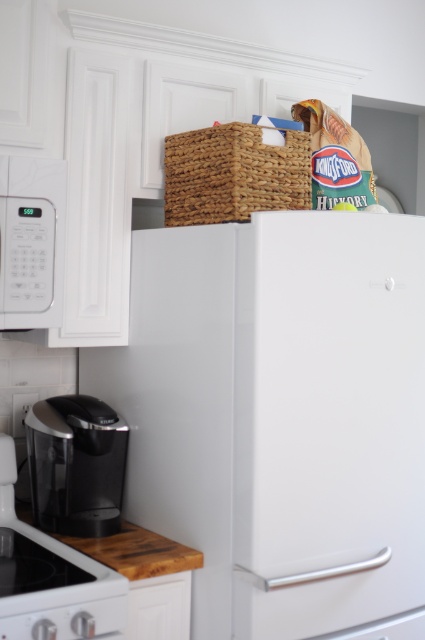
Question: Does white matte refrigerator at center lie in front of wooden cutting board at lower left?

Choices:
 (A) no
 (B) yes

Answer: (B)

Question: Does woven brown basket at upper center appear on the left side of sleek black coffee maker at lower left?

Choices:
 (A) yes
 (B) no

Answer: (B)

Question: Does woven brown basket at upper center have a smaller size compared to sleek black coffee maker at lower left?

Choices:
 (A) no
 (B) yes

Answer: (A)

Question: Which of the following is the farthest from the observer?

Choices:
 (A) (99, 461)
 (B) (150, 544)
 (C) (178, 308)

Answer: (A)

Question: Which of these objects is positioned closest to the woven brown basket at upper center?

Choices:
 (A) wooden cutting board at lower left
 (B) white matte refrigerator at center

Answer: (B)

Question: Which point is closer to the camera?

Choices:
 (A) woven brown basket at upper center
 (B) wooden cutting board at lower left
 (C) sleek black coffee maker at lower left
 (D) white matte refrigerator at center

Answer: (D)